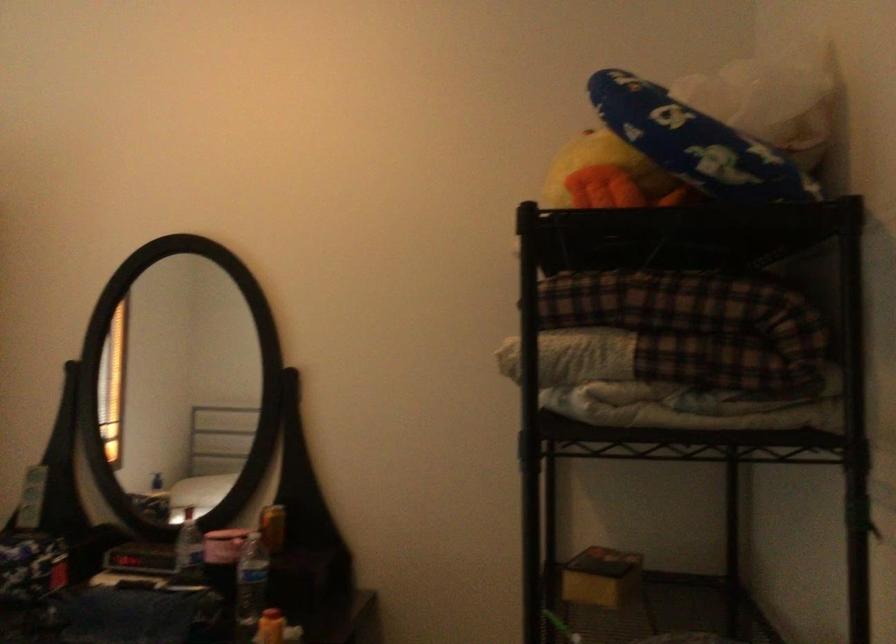
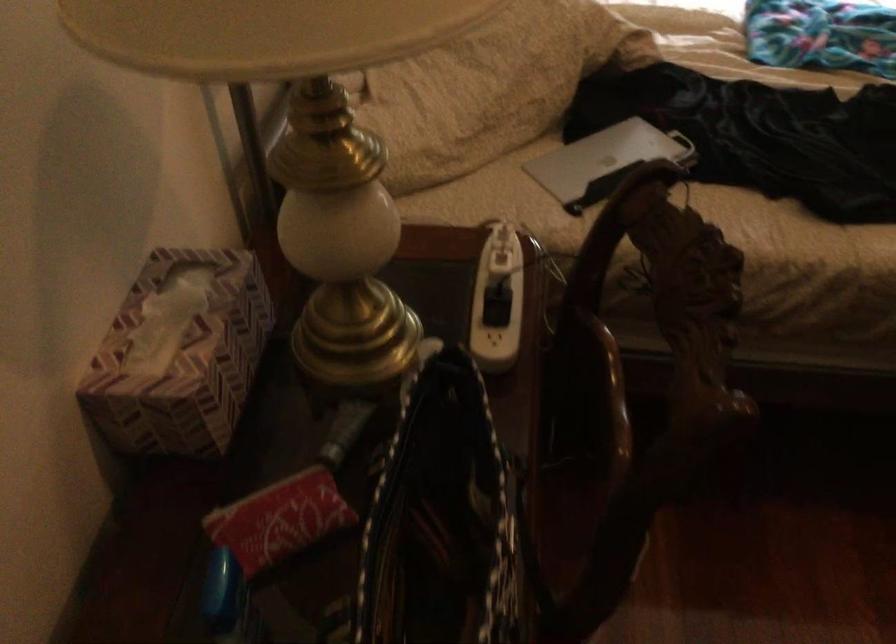
The images are taken continuously from a first-person perspective. In which direction is your viewpoint rotating?

The camera rotated toward left-down.